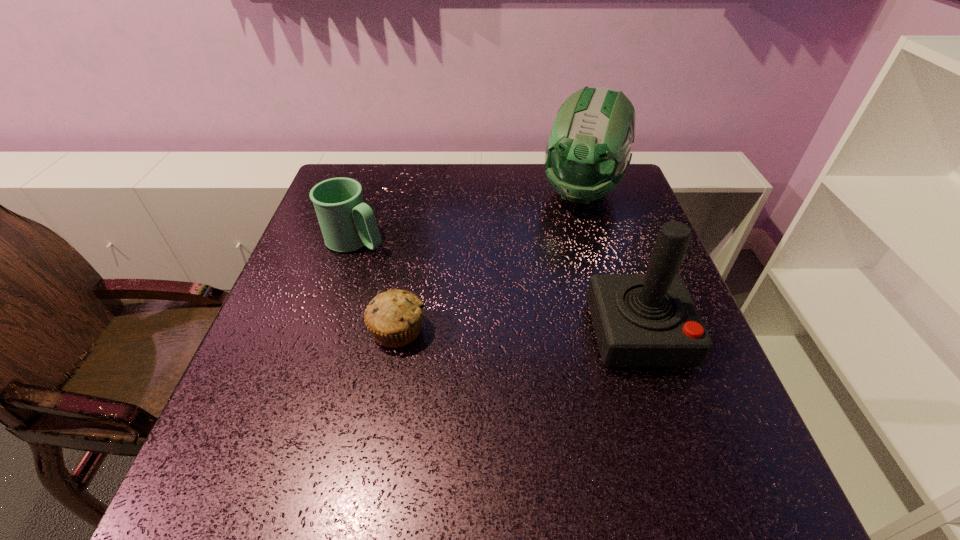
The image size is (960, 540). What are the coordinates of `the second object from left to right` in the screenshot? It's located at (394, 317).

The width and height of the screenshot is (960, 540). In order to click on the shortest object in this screenshot , I will do `click(394, 317)`.

I want to click on joystick, so click(x=640, y=320).

Image resolution: width=960 pixels, height=540 pixels. What are the coordinates of `football helmet` in the screenshot? It's located at (588, 150).

The width and height of the screenshot is (960, 540). I want to click on the third nearest object, so click(x=347, y=223).

This screenshot has width=960, height=540. I want to click on the leftmost object, so click(347, 223).

Find the location of a particular element. The width and height of the screenshot is (960, 540). free space located 0.200m on the back of the muffin is located at coordinates (412, 249).

Find the location of a particular element. vacant area situated 0.090m on the base of the joystick is located at coordinates (665, 415).

Where is `vacant region located 0.270m on the visor of the football helmet`? The image size is (960, 540). vacant region located 0.270m on the visor of the football helmet is located at coordinates (546, 287).

Image resolution: width=960 pixels, height=540 pixels. I want to click on free spot located on the visor of the football helmet, so click(547, 284).